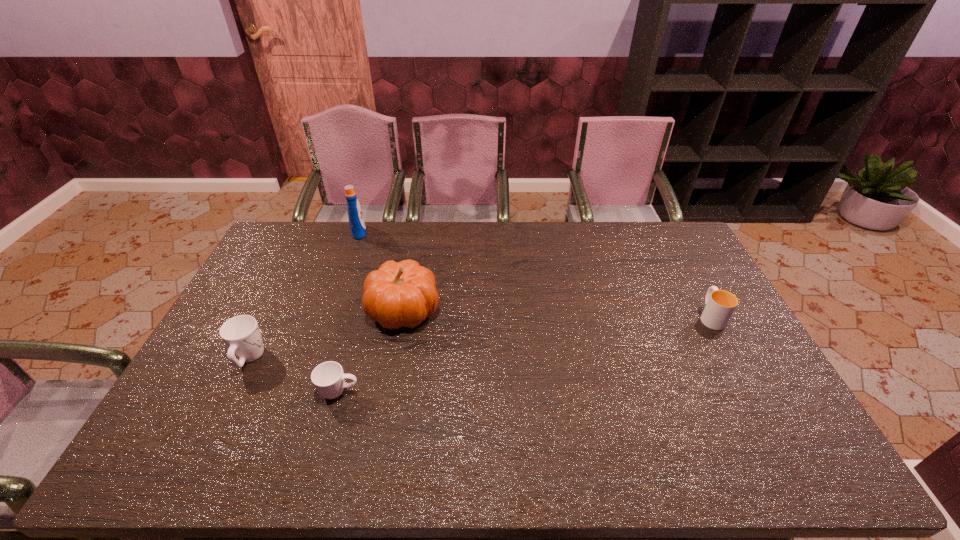
Locate an element on the screen. the farthest object is located at coordinates (356, 221).

This screenshot has width=960, height=540. In order to click on detergent in this screenshot , I will do `click(356, 221)`.

You are a GUI agent. You are given a task and a screenshot of the screen. Output one action in this format:
    pyautogui.click(x=<x>, y=<y>)
    Task: Click on the second tallest object
    
    Given the screenshot: What is the action you would take?
    pyautogui.click(x=403, y=294)

Where is `the second nearest object`? the second nearest object is located at coordinates (241, 334).

Where is `mug`? mug is located at coordinates (241, 334).

Where is `the fourth tallest object`? The width and height of the screenshot is (960, 540). the fourth tallest object is located at coordinates [x=720, y=305].

Where is `the farther cup`? This screenshot has height=540, width=960. the farther cup is located at coordinates (720, 305).

This screenshot has height=540, width=960. In order to click on the left cup in this screenshot , I will do `click(328, 378)`.

Locate an element on the screen. The width and height of the screenshot is (960, 540). the shortest object is located at coordinates (328, 378).

The height and width of the screenshot is (540, 960). Identify the location of free space located on the label of the second object from left to right. (387, 232).